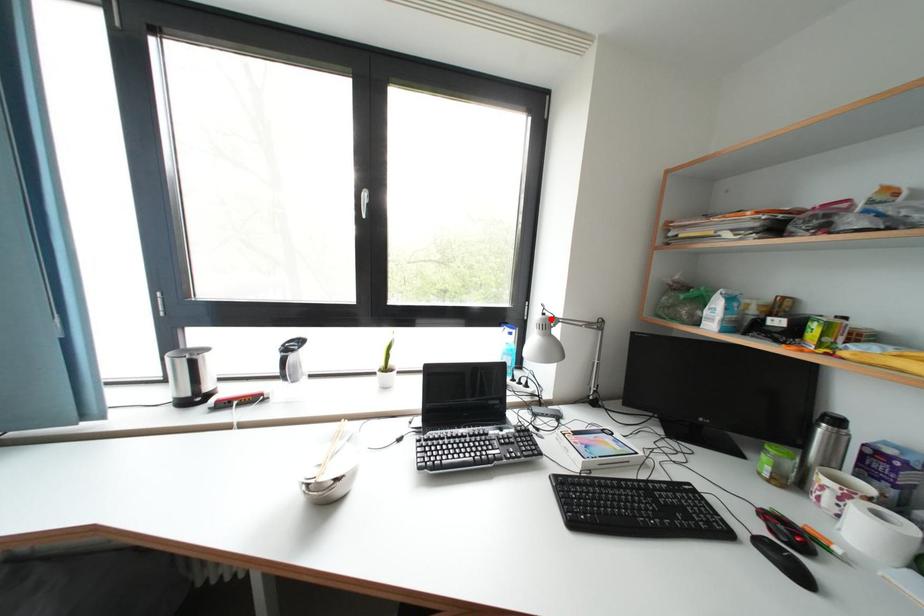
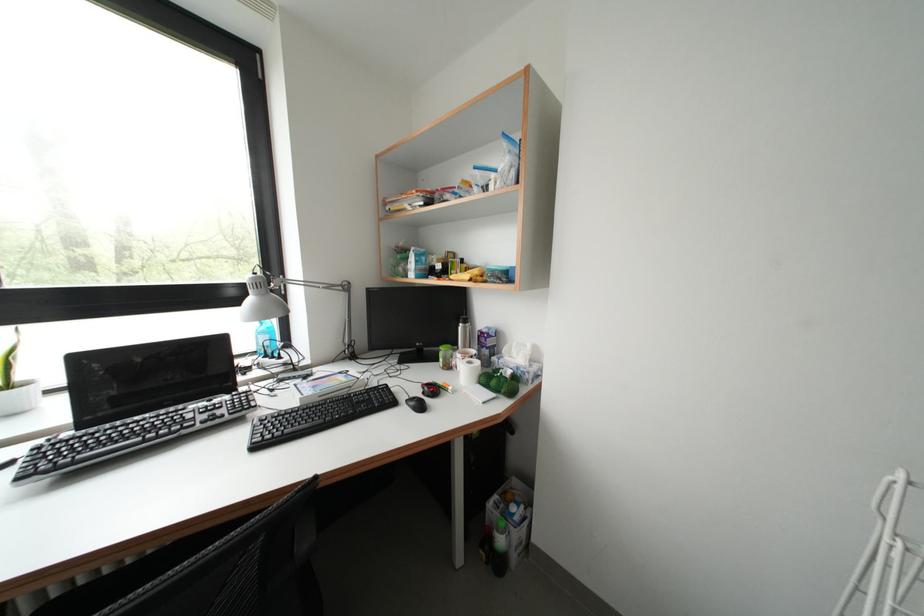
Question: I am providing you with two images of the same scene from different viewpoints. Image1 has a red point marked. In image2, the corresponding 3D location appears at what relative position? Reply with the corresponding letter.

Choices:
 (A) Closer
 (B) Farther

Answer: (B)